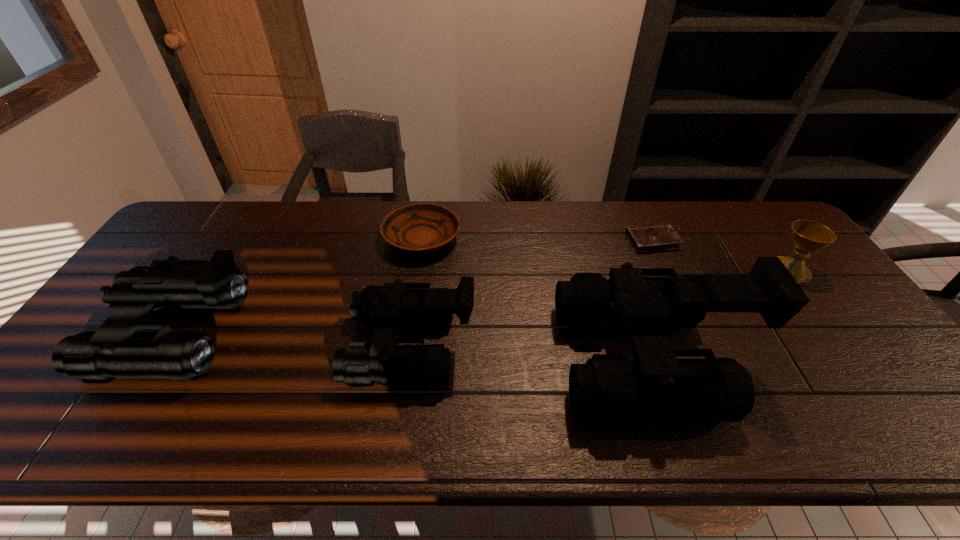
Find the location of a particular element. The width and height of the screenshot is (960, 540). vacant point located between the shortest binoculars and the shortest object is located at coordinates (533, 293).

The image size is (960, 540). Find the location of `empty space that is in between the leftmost binoculars and the second shortest object`. empty space that is in between the leftmost binoculars and the second shortest object is located at coordinates (303, 286).

Identify the location of free space between the plate and the third shortest object. (606, 254).

I want to click on vacant space that's between the leftmost binoculars and the plate, so click(x=303, y=286).

Identify the location of free spot between the plate and the fifth shortest object. This screenshot has height=540, width=960. (303, 286).

Point out which object is positioned as the nearest to the leftmost object. Please provide its 2D coordinates. Your answer should be formatted as a tuple, i.e. [(x, y)], where the tuple contains the x and y coordinates of a point satisfying the conditions above.

[(384, 308)]

Find the location of a particular element. This screenshot has height=540, width=960. object that is the closest to the chalice is located at coordinates (609, 388).

Identify which binoculars is the second closest to the shortest object. Please provide its 2D coordinates. Your answer should be formatted as a tuple, i.e. [(x, y)], where the tuple contains the x and y coordinates of a point satisfying the conditions above.

[(384, 308)]

Choose which binoculars is the second nearest neighbor to the shortest object. Please provide its 2D coordinates. Your answer should be formatted as a tuple, i.e. [(x, y)], where the tuple contains the x and y coordinates of a point satisfying the conditions above.

[(384, 308)]

Where is `vacant space that satisfies the following two spatial constraints: 1. on the front side of the diary; 2. on the front lenses of the second binoculars from right to left`? This screenshot has height=540, width=960. vacant space that satisfies the following two spatial constraints: 1. on the front side of the diary; 2. on the front lenses of the second binoculars from right to left is located at coordinates (698, 346).